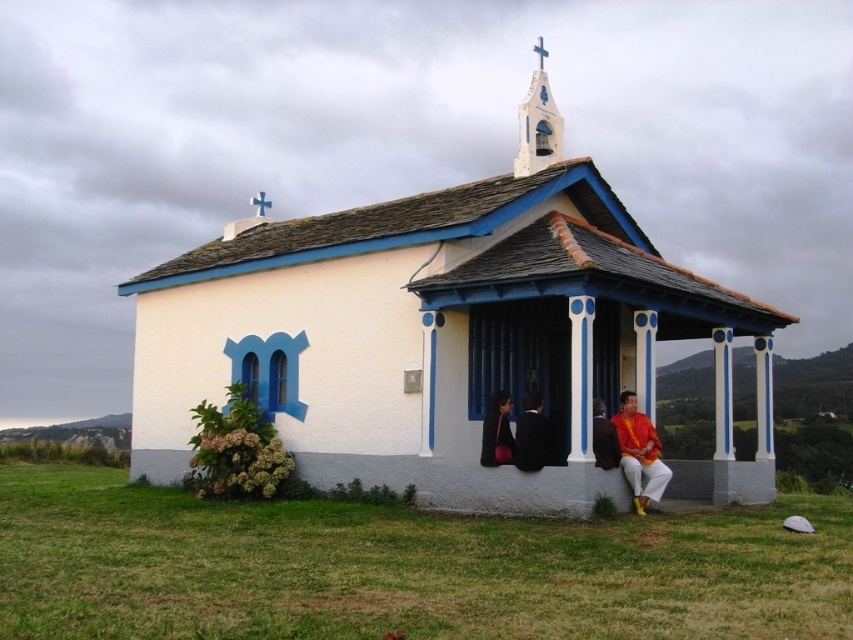
Is shiny orange fabric at lower right wider than white painted wood bell at upper center?

In fact, shiny orange fabric at lower right might be narrower than white painted wood bell at upper center.

Is shiny orange fabric at lower right thinner than white painted wood bell at upper center?

Yes.

Image resolution: width=853 pixels, height=640 pixels. Identify the location of shiny orange fabric at lower right. (639, 452).

Can you confirm if matte black suit at center is bigger than white painted wood bell at upper center?

No, matte black suit at center is not bigger than white painted wood bell at upper center.

Image resolution: width=853 pixels, height=640 pixels. I want to click on matte black suit at center, so click(517, 435).

Does white painted wood bell at upper center appear on the right side of matte black jacket at center?

Yes, white painted wood bell at upper center is to the right of matte black jacket at center.

Based on the photo, does white painted wood bell at upper center appear under matte black jacket at center?

No.

Is point (527, 145) positioned before point (483, 419)?

That is False.

Locate an element on the screen. The image size is (853, 640). white painted wood bell at upper center is located at coordinates (538, 124).